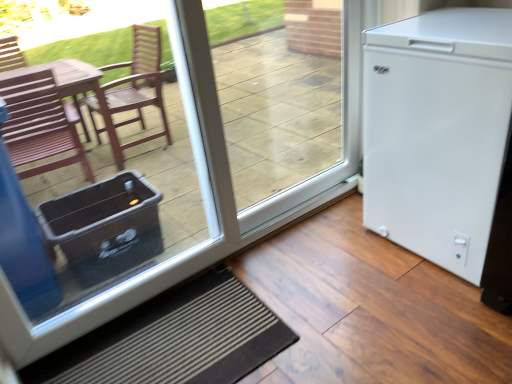
The width and height of the screenshot is (512, 384). What do you see at coordinates (437, 132) in the screenshot?
I see `white matte refrigerator at right` at bounding box center [437, 132].

Measure the distance between point (423, 153) and camera.

Point (423, 153) is 4.78 feet away from camera.

Image resolution: width=512 pixels, height=384 pixels. I want to click on white matte refrigerator at right, so click(203, 193).

Describe the element at coordinates (175, 340) in the screenshot. This screenshot has width=512, height=384. I see `black textured mat at lower center` at that location.

Locate an element on the screen. This screenshot has height=384, width=512. white matte refrigerator at right is located at coordinates (437, 132).

In terms of height, does white matte refrigerator at right look taller or shorter compared to black textured mat at lower center?

Considering their sizes, white matte refrigerator at right has more height than black textured mat at lower center.

Can you confirm if white matte refrigerator at right is positioned to the left of black textured mat at lower center?

No.

Is white matte refrigerator at right placed right next to black textured mat at lower center?

white matte refrigerator at right and black textured mat at lower center are not in contact.

Looking at the image, does white matte refrigerator at right seem bigger or smaller compared to black textured mat at lower center?

In the image, white matte refrigerator at right appears to be larger than black textured mat at lower center.

Which object is thinner, white matte refrigerator at right or white matte refrigerator at right?

white matte refrigerator at right.

Looking at this image, from a real-world perspective, is white matte refrigerator at right located higher than white matte refrigerator at right?

Yes, from a real-world perspective, white matte refrigerator at right is above white matte refrigerator at right.

Consider the image. Considering the positions of objects white matte refrigerator at right and white matte refrigerator at right in the image provided, who is more to the right, white matte refrigerator at right or white matte refrigerator at right?

Positioned to the right is white matte refrigerator at right.

Looking at this image, from a real-world perspective, is transparent glass door at center below white matte refrigerator at right?

Incorrect, from a real-world perspective, transparent glass door at center is higher than white matte refrigerator at right.

What's the angular difference between transparent glass door at center and white matte refrigerator at right's facing directions?

The angle between the facing direction of transparent glass door at center and the facing direction of white matte refrigerator at right is 0.268 degrees.

Is transparent glass door at center positioned with its back to white matte refrigerator at right?

Yes.

Between white matte refrigerator at right and white matte refrigerator at right, which one has larger size?

Bigger between the two is white matte refrigerator at right.

From the image's perspective, relative to white matte refrigerator at right, is white matte refrigerator at right above or below?

Clearly, from the image's perspective, white matte refrigerator at right is above white matte refrigerator at right.

Is white matte refrigerator at right positioned before white matte refrigerator at right?

No, the depth of white matte refrigerator at right is greater than that of white matte refrigerator at right.

Considering the relative positions of white matte refrigerator at right and white matte refrigerator at right in the image provided, is white matte refrigerator at right to the left of white matte refrigerator at right from the viewer's perspective?

In fact, white matte refrigerator at right is to the right of white matte refrigerator at right.

Which object is positioned more to the left, transparent glass door at center or white matte refrigerator at right?

From the viewer's perspective, transparent glass door at center appears more on the left side.

How much distance is there between transparent glass door at center and white matte refrigerator at right?

1.58 meters.

Does transparent glass door at center turn towards white matte refrigerator at right?

Yes, transparent glass door at center is facing white matte refrigerator at right.

Does transparent glass door at center have a greater width compared to white matte refrigerator at right?

In fact, transparent glass door at center might be narrower than white matte refrigerator at right.

Between white matte refrigerator at right and transparent glass door at center, which one has smaller size?

transparent glass door at center.

How different are the orientations of white matte refrigerator at right and transparent glass door at center in degrees?

The facing directions of white matte refrigerator at right and transparent glass door at center are 91.5 degrees apart.

Which object is wider, white matte refrigerator at right or transparent glass door at center?

With larger width is white matte refrigerator at right.

Considering the relative positions of white matte refrigerator at right and transparent glass door at center in the image provided, is white matte refrigerator at right to the left or to the right of transparent glass door at center?

Based on their positions, white matte refrigerator at right is located to the right of transparent glass door at center.

Is white matte refrigerator at right at the back of black textured mat at lower center?

Absolutely, black textured mat at lower center is directed away from white matte refrigerator at right.

Locate an element on the screen. This screenshot has width=512, height=384. doormat beneath the white matte refrigerator at right (from a real-world perspective) is located at coordinates (175, 340).

Is black textured mat at lower center thinner than white matte refrigerator at right?

No, black textured mat at lower center is not thinner than white matte refrigerator at right.

From the image's perspective, which one is positioned lower, black textured mat at lower center or white matte refrigerator at right?

black textured mat at lower center.

I want to click on door in front of the black textured mat at lower center, so click(x=203, y=193).

At what (x,y) coordinates should I click in order to perform the action: click on door that is on the left side of white matte refrigerator at right. Please return your answer as a coordinate pair (x, y). The height and width of the screenshot is (384, 512). Looking at the image, I should click on (203, 193).

Estimate the real-world distances between objects in this image. Which object is closer to black textured mat at lower center, transparent glass door at center or white matte refrigerator at right?

The object closer to black textured mat at lower center is white matte refrigerator at right.

From the image, which object appears to be farther from white matte refrigerator at right, white matte refrigerator at right or black textured mat at lower center?

black textured mat at lower center is further to white matte refrigerator at right.

Based on their spatial positions, is white matte refrigerator at right or transparent glass door at center closer to white matte refrigerator at right?

Among the two, white matte refrigerator at right is located nearer to white matte refrigerator at right.

Considering their positions, is white matte refrigerator at right positioned closer to black textured mat at lower center than transparent glass door at center?

white matte refrigerator at right is positioned closer to the anchor black textured mat at lower center.

Estimate the real-world distances between objects in this image. Which object is closer to transparent glass door at center, white matte refrigerator at right or black textured mat at lower center?

black textured mat at lower center lies closer to transparent glass door at center than the other object.

Considering their positions, is white matte refrigerator at right positioned closer to transparent glass door at center than white matte refrigerator at right?

The object closer to transparent glass door at center is white matte refrigerator at right.

Looking at the image, which one is located closer to black textured mat at lower center, white matte refrigerator at right or white matte refrigerator at right?

The object closer to black textured mat at lower center is white matte refrigerator at right.

When comparing their distances from white matte refrigerator at right, does white matte refrigerator at right or transparent glass door at center seem further?

Based on the image, transparent glass door at center appears to be further to white matte refrigerator at right.

Where is `window between black textured mat at lower center and white matte refrigerator at right in the horizontal direction`? window between black textured mat at lower center and white matte refrigerator at right in the horizontal direction is located at coordinates (288, 102).

Find the location of a particular element. This screenshot has width=512, height=384. door between black textured mat at lower center and white matte refrigerator at right is located at coordinates coord(203,193).

Locate an element on the screen. This screenshot has width=512, height=384. door that lies between transparent glass door at center and black textured mat at lower center from top to bottom is located at coordinates (203, 193).

Identify the location of window located between white matte refrigerator at right and white matte refrigerator at right in the left-right direction. The height and width of the screenshot is (384, 512). (288, 102).